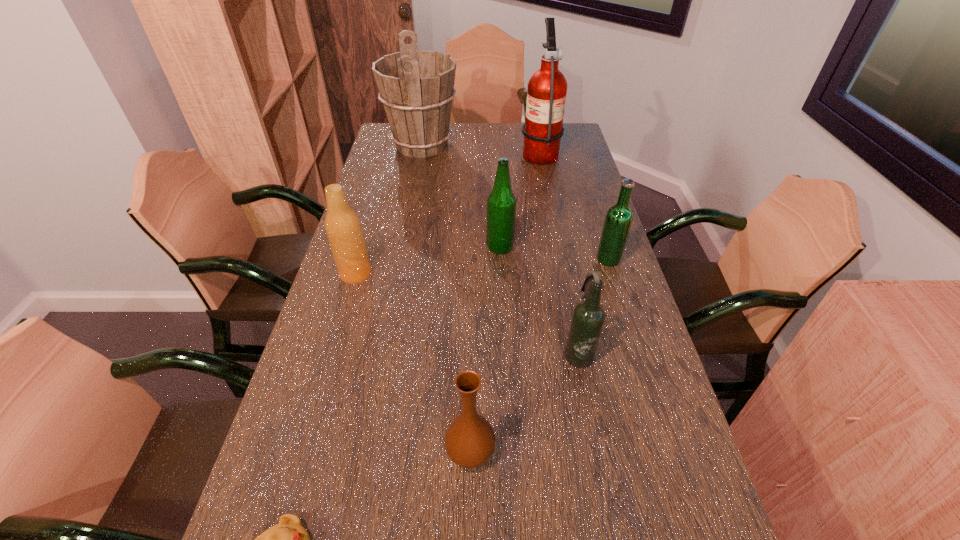
Where is `fire extinguisher`? This screenshot has height=540, width=960. fire extinguisher is located at coordinates (546, 95).

You are a GUI agent. You are given a task and a screenshot of the screen. Output one action in this format:
    pyautogui.click(x=<x>, y=<y>)
    Task: Click on the bucket
    This screenshot has width=960, height=540.
    Given the screenshot: What is the action you would take?
    pyautogui.click(x=416, y=87)

Find the location of a particular element. the third beer bottle from right to left is located at coordinates (501, 204).

The image size is (960, 540). Find the location of `the leftmost beer bottle`. the leftmost beer bottle is located at coordinates (343, 228).

You are a GUI agent. You are given a task and a screenshot of the screen. Output one action in this format:
    pyautogui.click(x=<x>, y=<y>)
    Task: Click on the rightmost object
    The height and width of the screenshot is (540, 960).
    Given the screenshot: What is the action you would take?
    [x=618, y=220]

Find the location of `the nearest beer bottle`. the nearest beer bottle is located at coordinates (588, 318).

This screenshot has width=960, height=540. Find the location of `the third nearest object`. the third nearest object is located at coordinates (588, 318).

You are a GUI agent. You are given a task and a screenshot of the screen. Output one action in this format:
    pyautogui.click(x=<x>, y=<y>)
    Task: Click on the vase
    Image resolution: width=960 pixels, height=540 pixels.
    Given the screenshot: What is the action you would take?
    pyautogui.click(x=469, y=441)

I want to click on free region located on the nozzle and handle of the tallest object, so click(x=440, y=152).

Where is `free space located on the nozzle and handle of the tallest object`? The image size is (960, 540). free space located on the nozzle and handle of the tallest object is located at coordinates (468, 152).